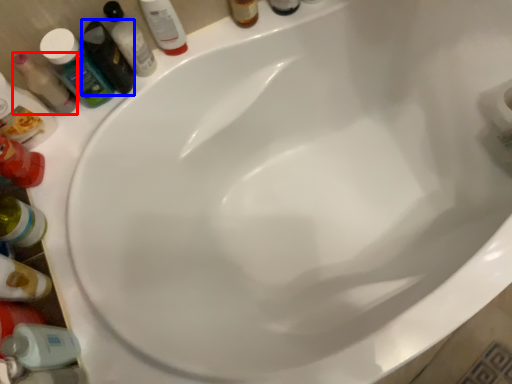
Question: Which of the following is the farthest to the observer, mouthwash (highlighted by a red box) or toiletry (highlighted by a blue box)?

Choices:
 (A) mouthwash
 (B) toiletry

Answer: (B)